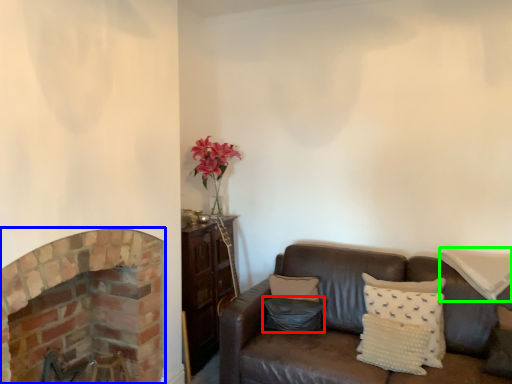
Question: Based on their relative distances, which object is farther from pillow (highlighted by a red box)? Choose from fireplace (highlighted by a blue box) and pillow (highlighted by a green box).

Choices:
 (A) fireplace
 (B) pillow

Answer: (A)